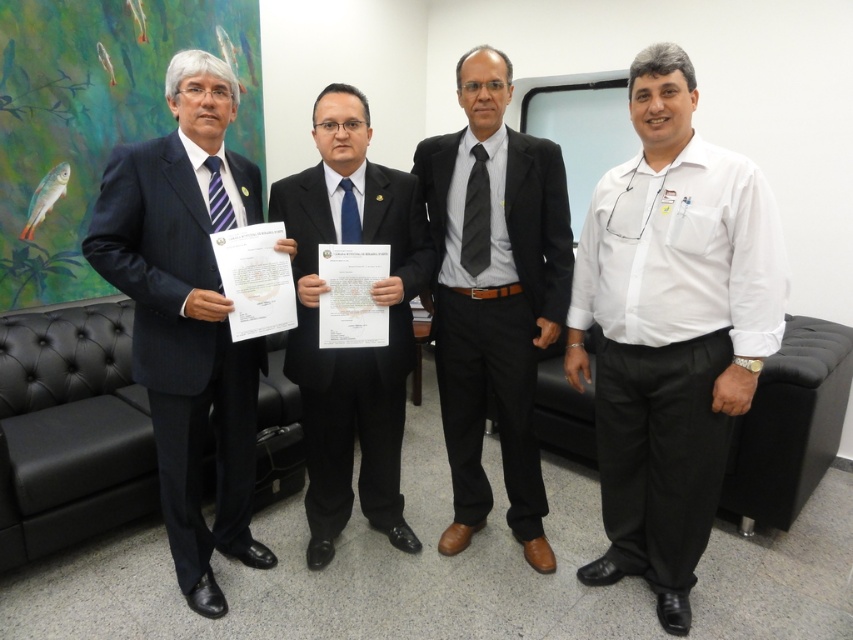
Question: Can you confirm if striped fabric tie at left is positioned to the right of blue silk tie at center?

Choices:
 (A) no
 (B) yes

Answer: (A)

Question: Among these objects, which one is farthest from the camera?

Choices:
 (A) blue silk tie at center
 (B) matte black suit at left
 (C) white cotton shirt at right
 (D) black striped tie at center

Answer: (D)

Question: Does matte black suit at left lie behind blue silk tie at center?

Choices:
 (A) no
 (B) yes

Answer: (A)

Question: Where is matte black suit at left located in relation to black suit at center in the image?

Choices:
 (A) below
 (B) above

Answer: (A)

Question: Which of the following is the farthest from the observer?

Choices:
 (A) (180, 308)
 (B) (215, 216)
 (C) (548, 218)

Answer: (C)

Question: Estimate the real-world distances between objects in this image. Which object is closer to the black smooth suit at center?

Choices:
 (A) blue silk tie at center
 (B) white cotton shirt at right
 (C) striped fabric tie at left
 (D) black suit at center

Answer: (D)